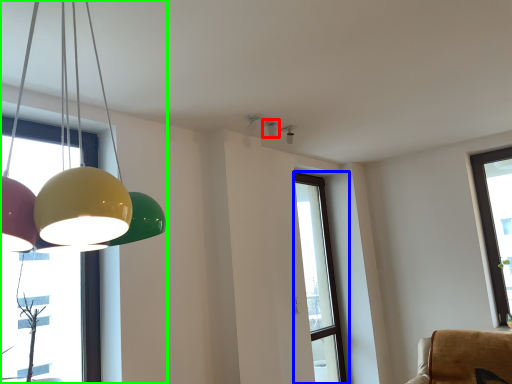
Question: Based on their relative distances, which object is nearer to lamp (highlighted by a red box)? Choose from window (highlighted by a blue box) and lamp (highlighted by a green box).

Choices:
 (A) window
 (B) lamp

Answer: (A)